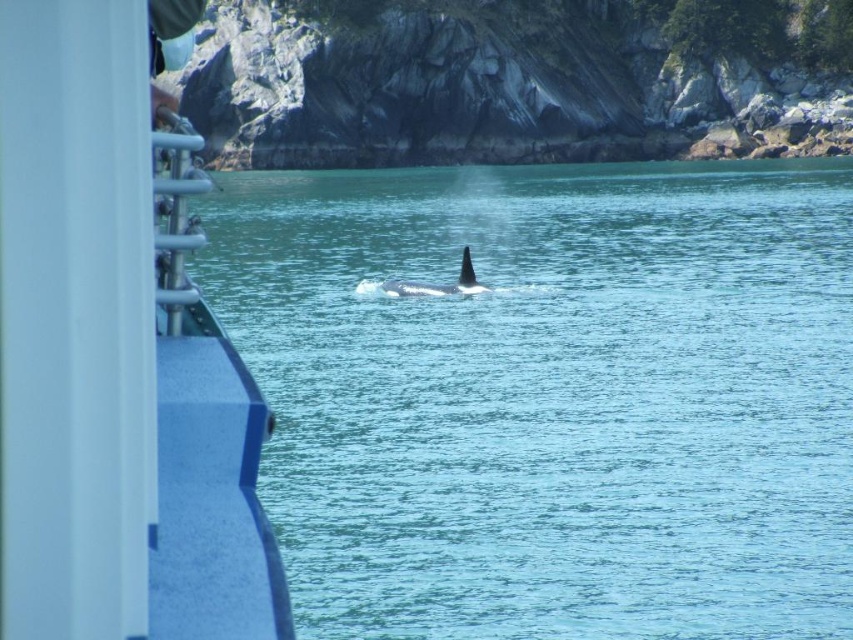
In the scene shown: Is blue rubber boat at left smaller than black smooth whale at center?

No.

Locate an element on the screen. The height and width of the screenshot is (640, 853). blue rubber boat at left is located at coordinates (113, 362).

Who is lower down, clear blue water at center or blue rubber boat at left?

blue rubber boat at left

Is clear blue water at center above blue rubber boat at left?

Correct, clear blue water at center is located above blue rubber boat at left.

Between point (447, 401) and point (117, 580), which one is positioned in front?

Point (117, 580) is more forward.

Locate an element on the screen. clear blue water at center is located at coordinates click(x=550, y=396).

Can you confirm if clear blue water at center is taller than black smooth whale at center?

Yes, clear blue water at center is taller than black smooth whale at center.

Does clear blue water at center appear on the right side of black smooth whale at center?

Correct, you'll find clear blue water at center to the right of black smooth whale at center.

Who is more forward, (550, 611) or (432, 294)?

Point (550, 611) is in front.

What are the coordinates of `clear blue water at center` in the screenshot? It's located at (550, 396).